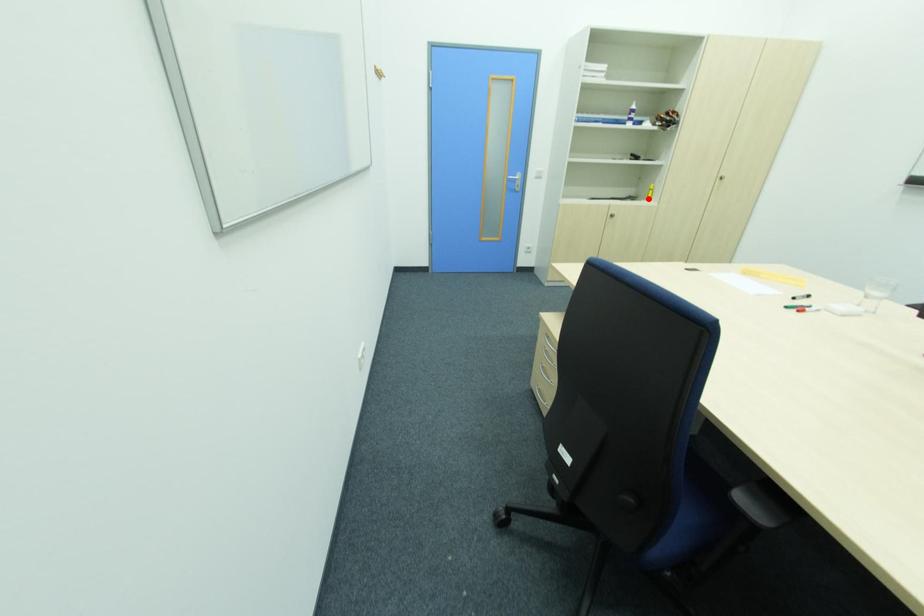
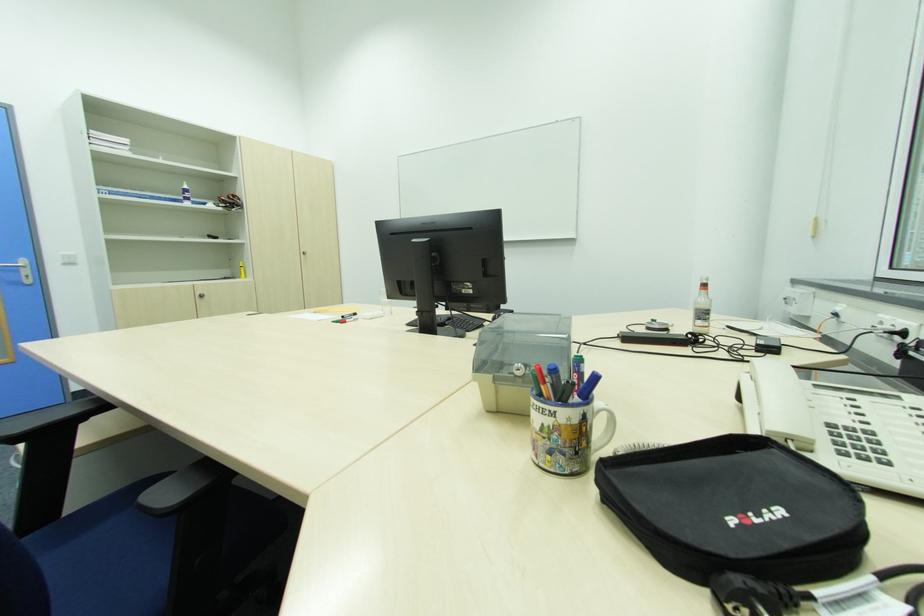
In the second image, find the point that corresponds to the highlighted location in the first image.

(244, 277)